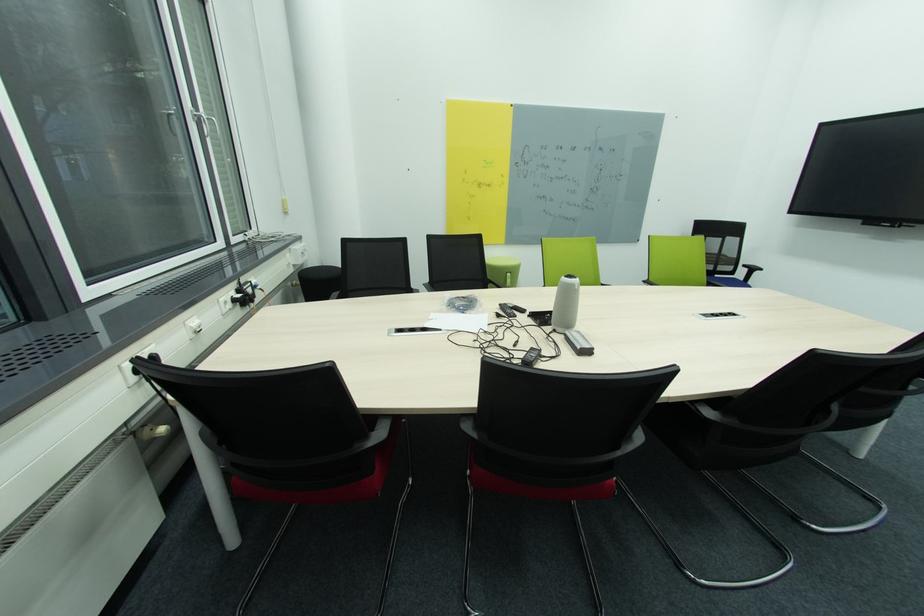
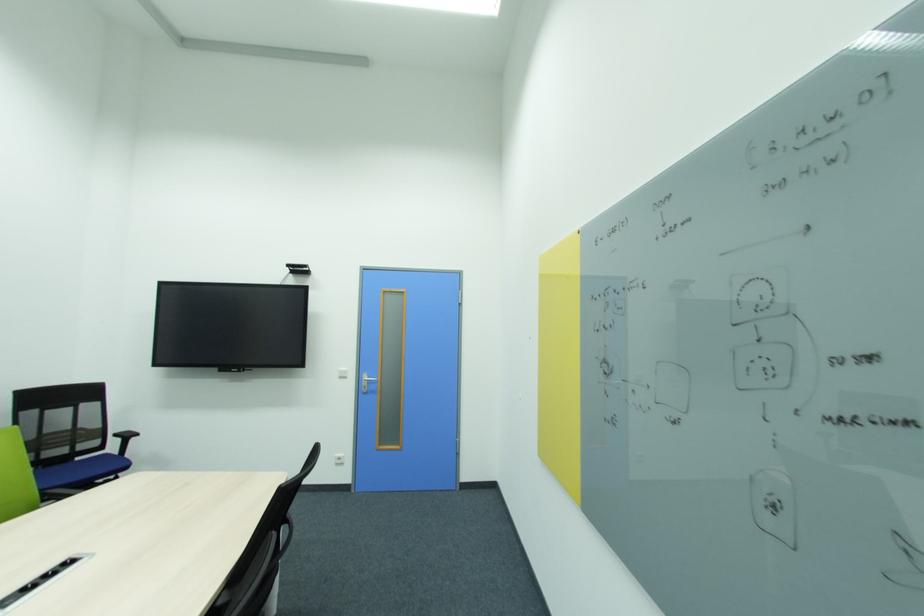
Question: The images are taken continuously from a first-person perspective. In which direction is your viewpoint rotating?

Choices:
 (A) Left
 (B) Right
 (C) Up
 (D) Down

Answer: (B)